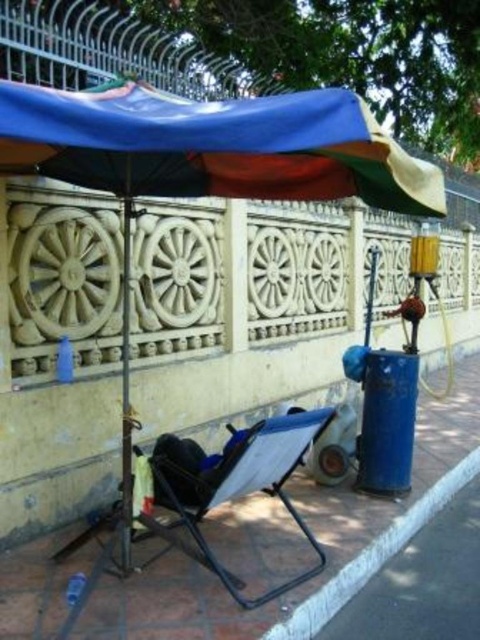
Which of these two, blue fabric chair at lower center or blue fabric folding chair at center, stands shorter?

Standing shorter between the two is blue fabric chair at lower center.

Measure the distance between blue fabric chair at lower center and camera.

A distance of 3.05 meters exists between blue fabric chair at lower center and camera.

The image size is (480, 640). Find the location of `blue fabric chair at lower center`. blue fabric chair at lower center is located at coordinates (310, 528).

Does blue fabric folding chair at center have a smaller size compared to metallic pole at center?

Actually, blue fabric folding chair at center might be larger than metallic pole at center.

Which is more to the right, blue fabric folding chair at center or metallic pole at center?

From the viewer's perspective, blue fabric folding chair at center appears more on the right side.

What do you see at coordinates (228, 484) in the screenshot? This screenshot has width=480, height=640. I see `blue fabric folding chair at center` at bounding box center [228, 484].

The height and width of the screenshot is (640, 480). I want to click on blue fabric folding chair at center, so click(228, 484).

Does polyester tarp at upper center appear on the left side of blue fabric folding chair at center?

Incorrect, polyester tarp at upper center is not on the left side of blue fabric folding chair at center.

Between point (165, 189) and point (289, 513), which one is positioned in front?

Point (165, 189)

This screenshot has height=640, width=480. What are the coordinates of `polyester tarp at upper center` in the screenshot? It's located at (214, 147).